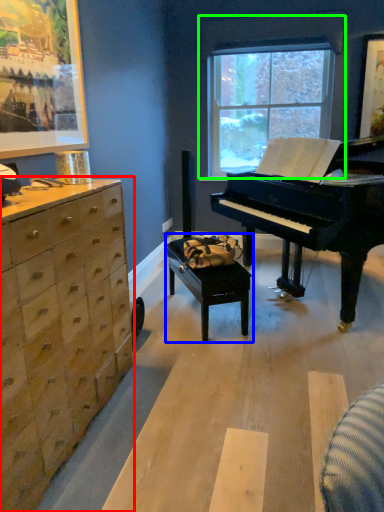
Question: Considering the real-world distances, which object is farthest from chest of drawers (highlighted by a red box)? table (highlighted by a blue box) or window (highlighted by a green box)?

Choices:
 (A) table
 (B) window

Answer: (B)